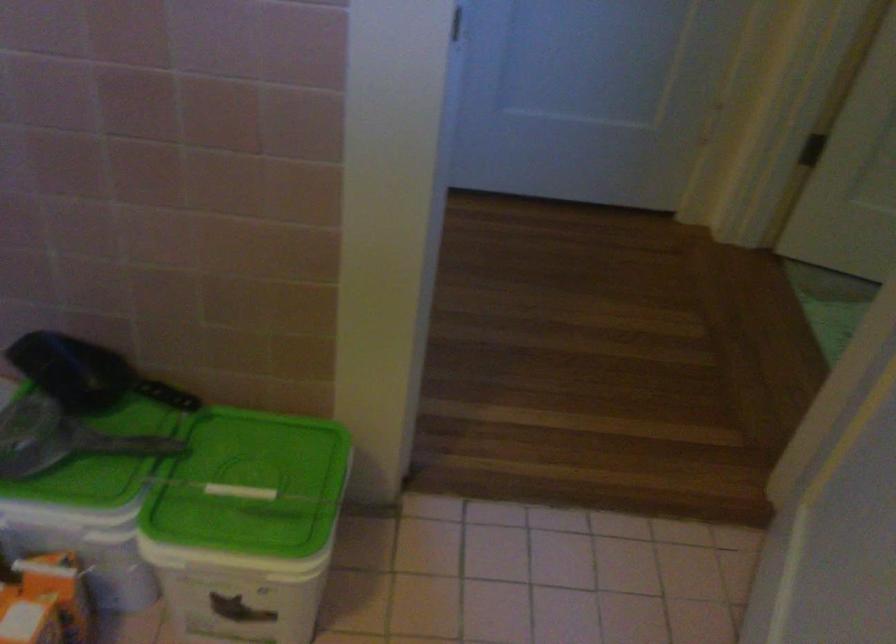
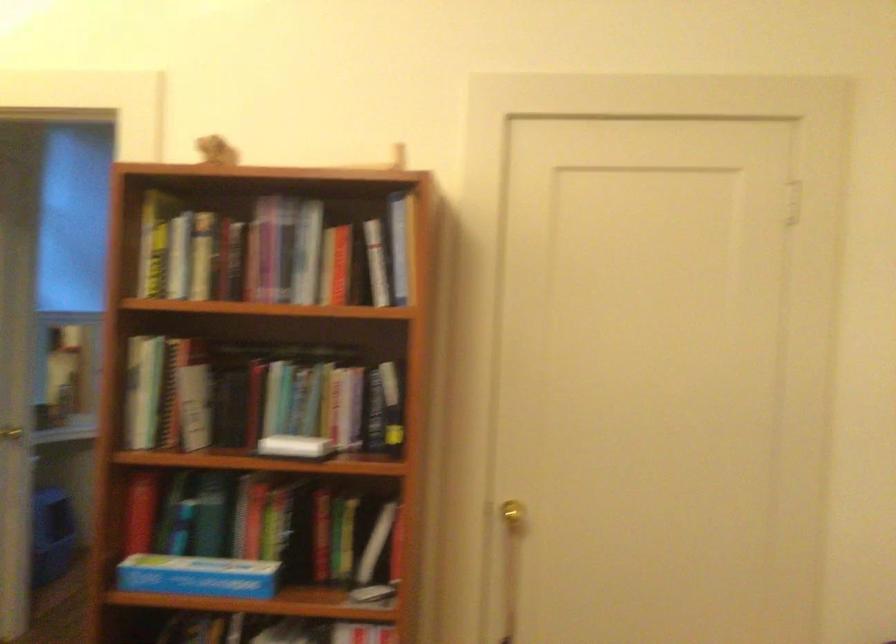
Question: I am providing you with two images of the same scene from different viewpoints. Which of the following objects are not visible in image2?

Choices:
 (A) small brown figurine
 (B) blue clothes hanger
 (C) gold door knob
 (D) green plastic lid

Answer: (D)